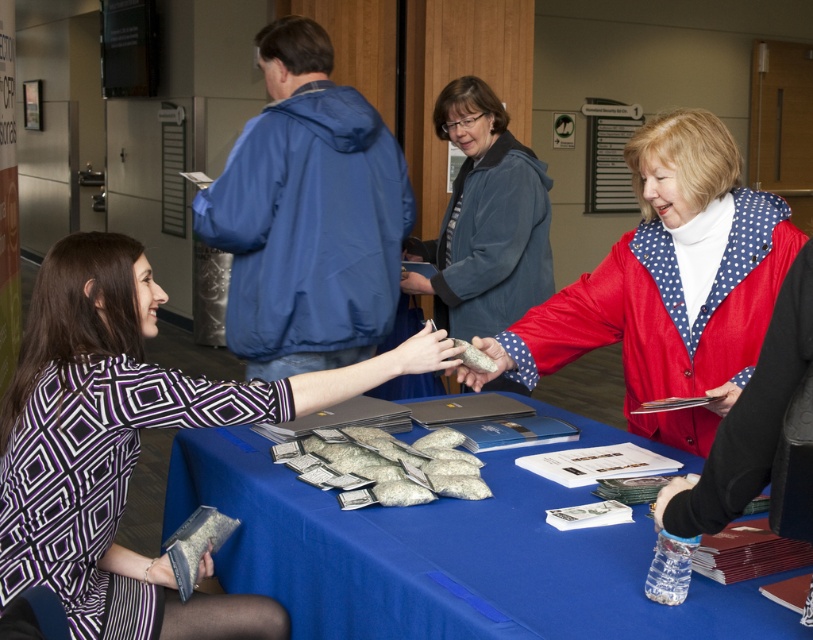
Who is lower down, polka dot fabric jacket at center or matte gray rock at center?

matte gray rock at center is below.

Does point (646, 180) lie behind point (470, 369)?

No, (646, 180) is closer to viewer.

Is point (637, 394) farther from camera compared to point (498, 346)?

No, (637, 394) is closer to viewer.

Identify the location of polka dot fabric jacket at center. (670, 284).

Based on the photo, how distant is blue fabric tablecloth at center from matte gray rock at center?

blue fabric tablecloth at center is 22.61 inches away from matte gray rock at center.

Does blue fabric tablecloth at center have a lesser width compared to matte gray rock at center?

In fact, blue fabric tablecloth at center might be wider than matte gray rock at center.

Where is `blue fabric tablecloth at center`? This screenshot has width=813, height=640. blue fabric tablecloth at center is located at coordinates (450, 552).

Image resolution: width=813 pixels, height=640 pixels. In order to click on blue fabric tablecloth at center in this screenshot , I will do `click(450, 552)`.

From the picture: Is the position of matte blue jacket at center less distant than that of clear plastic water bottle at lower right?

That is False.

In the scene shown: How distant is matte blue jacket at center from clear plastic water bottle at lower right?

A distance of 1.95 meters exists between matte blue jacket at center and clear plastic water bottle at lower right.

Does point (450, 83) come closer to viewer compared to point (661, 516)?

No.

Image resolution: width=813 pixels, height=640 pixels. In order to click on matte blue jacket at center in this screenshot , I will do `click(487, 218)`.